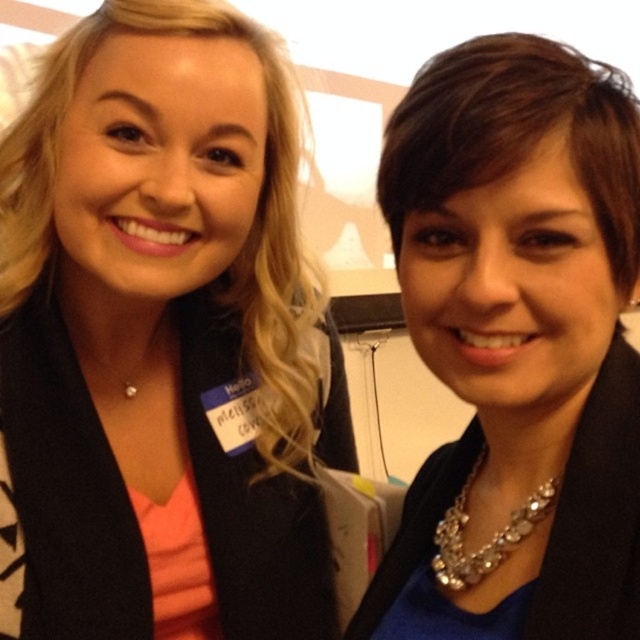
Does matte black blazer at center appear on the left side of sparkly silver necklace at lower right?

Indeed, matte black blazer at center is positioned on the left side of sparkly silver necklace at lower right.

Does point (304, 456) come behind point (442, 531)?

Yes, it is behind point (442, 531).

I want to click on matte black blazer at center, so coord(163,340).

Does matte black blazer at center have a lesser height compared to sparkly silver necklace at center?

No.

Can you confirm if matte black blazer at center is bigger than sparkly silver necklace at center?

Correct, matte black blazer at center is larger in size than sparkly silver necklace at center.

You are a GUI agent. You are given a task and a screenshot of the screen. Output one action in this format:
    pyautogui.click(x=<x>, y=<y>)
    Task: Click on the matte black blazer at center
    Image resolution: width=640 pixels, height=640 pixels.
    Given the screenshot: What is the action you would take?
    pyautogui.click(x=163, y=340)

Does sparkly silver necklace at center have a lesser height compared to sparkly silver necklace at lower right?

In fact, sparkly silver necklace at center may be taller than sparkly silver necklace at lower right.

How far apart are sparkly silver necklace at center and sparkly silver necklace at lower right?

sparkly silver necklace at center and sparkly silver necklace at lower right are 4.71 inches apart.

Where is `sparkly silver necklace at center`? This screenshot has height=640, width=640. sparkly silver necklace at center is located at coordinates (516, 346).